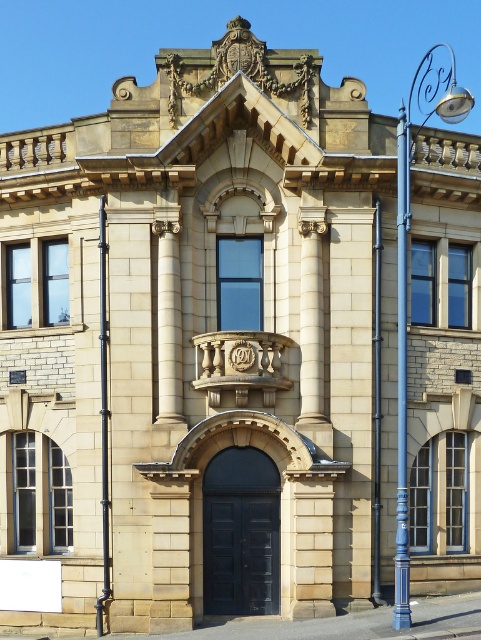
You are a delivery person approaching the historic building. You need to place a package on the blue metallic pole at right and the black pipe at center. Which object will the package be closer to after placement?

The package will be closer to the blue metallic pole at right because it is placed directly on it, while the black pipe at center is behind the pole.

You are standing in front of the historic building and notice two points marked on the facade. The first point is at coordinates point [104,561] and the second is at point [376,572]. Which of these two points is closer to you as you face the building?

Point [104,561] is in front of point [376,572], so it is closer to you as you face the building.

You are standing in front of the historic building and want to locate the blue metallic pole at right. According to the coordinates provided, where exactly is it positioned relative to the building?

The blue metallic pole at right is positioned at coordinates point [402,376] relative to the building.